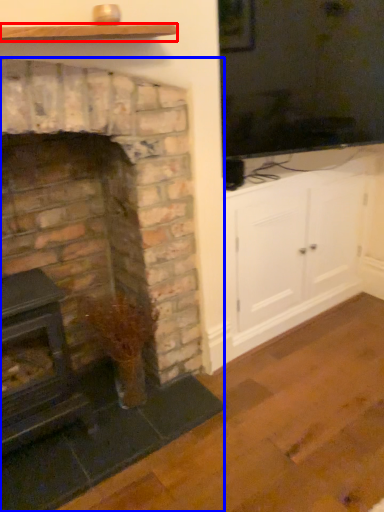
Question: Which object is closer to the camera taking this photo, shelf (highlighted by a red box) or fireplace (highlighted by a blue box)?

Choices:
 (A) shelf
 (B) fireplace

Answer: (B)